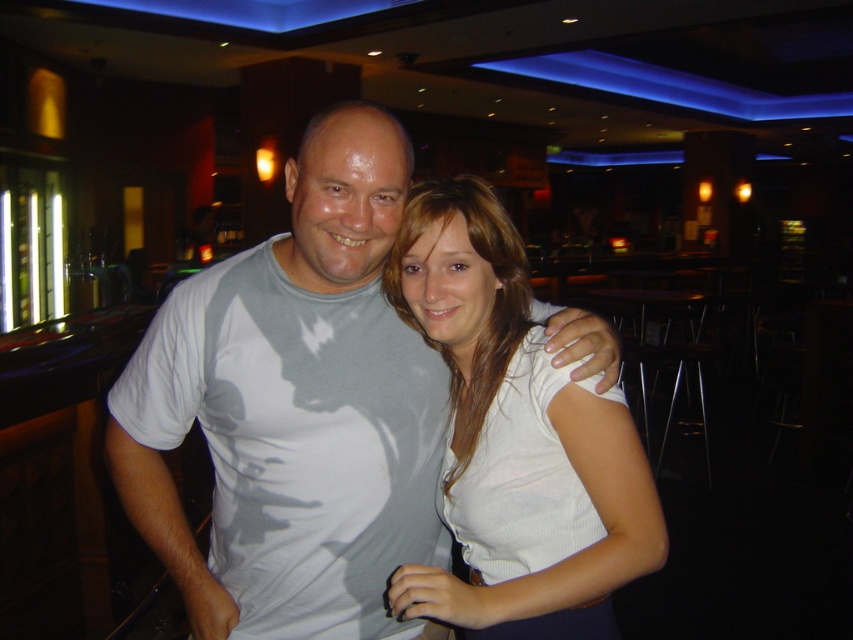
Question: Does white matte t-shirt at center lie in front of white ribbed shirt at center?

Choices:
 (A) yes
 (B) no

Answer: (B)

Question: Can you confirm if white matte t-shirt at center is smaller than white ribbed shirt at center?

Choices:
 (A) yes
 (B) no

Answer: (B)

Question: Among these objects, which one is nearest to the camera?

Choices:
 (A) white ribbed shirt at center
 (B) white matte t-shirt at center

Answer: (A)

Question: Can you confirm if white matte t-shirt at center is thinner than white ribbed shirt at center?

Choices:
 (A) no
 (B) yes

Answer: (A)